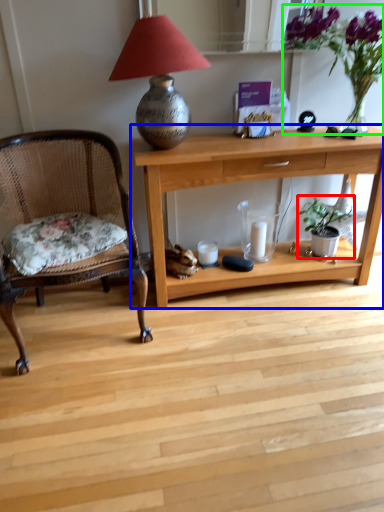
Question: Which is farther away from houseplant (highlighted by a red box)? desk (highlighted by a blue box) or floral arrangement (highlighted by a green box)?

Choices:
 (A) desk
 (B) floral arrangement

Answer: (B)